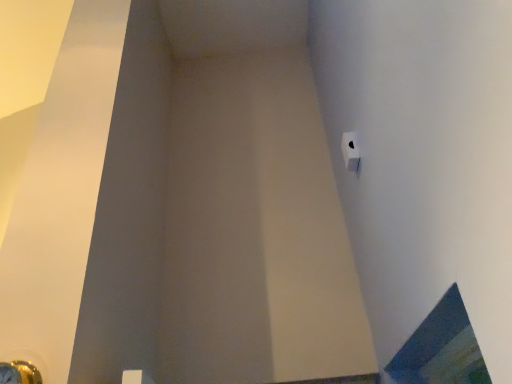
Question: From the image's perspective, is blue glass window at lower right above or below white matte toilet paper at upper right?

Choices:
 (A) below
 (B) above

Answer: (A)

Question: Choose the correct answer: Is blue glass window at lower right inside white matte toilet paper at upper right or outside it?

Choices:
 (A) outside
 (B) inside

Answer: (A)

Question: Which is farther from the white matte toilet paper at upper right?

Choices:
 (A) metallic gold door handle at lower left
 (B) blue glass window at lower right

Answer: (A)

Question: Which of these objects is positioned farthest from the blue glass window at lower right?

Choices:
 (A) metallic gold door handle at lower left
 (B) white matte toilet paper at upper right

Answer: (A)